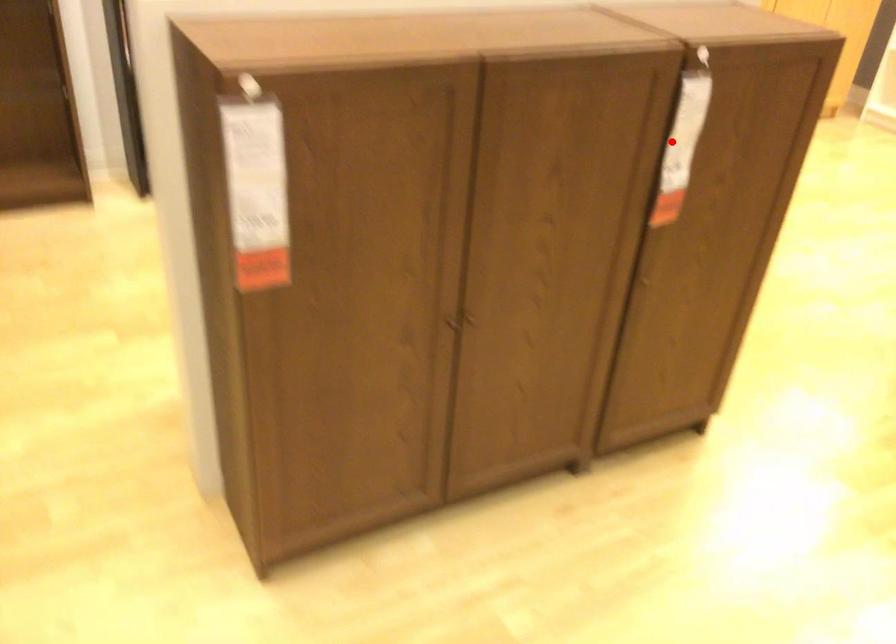
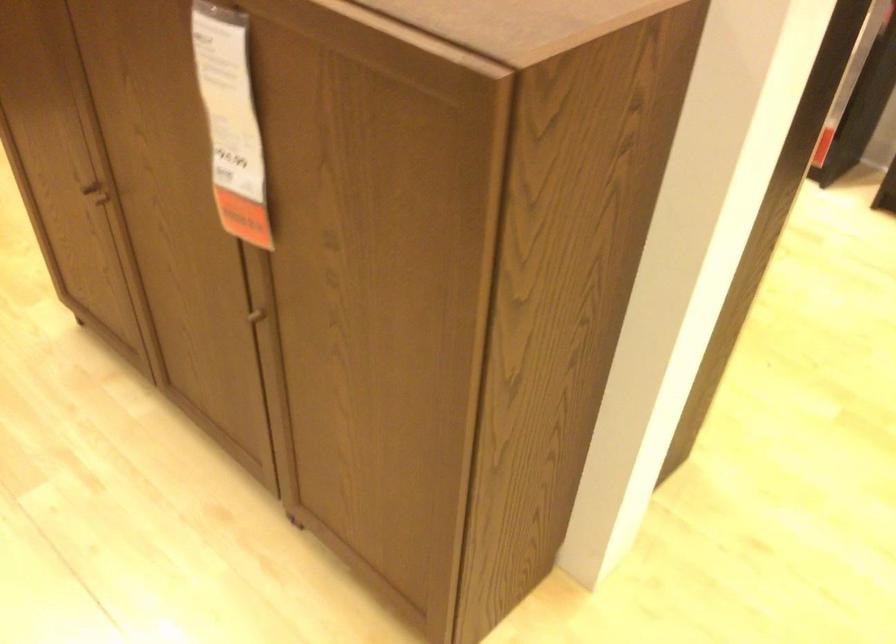
The point at the highlighted location is marked in the first image. Where is the corresponding point in the second image?

(230, 122)